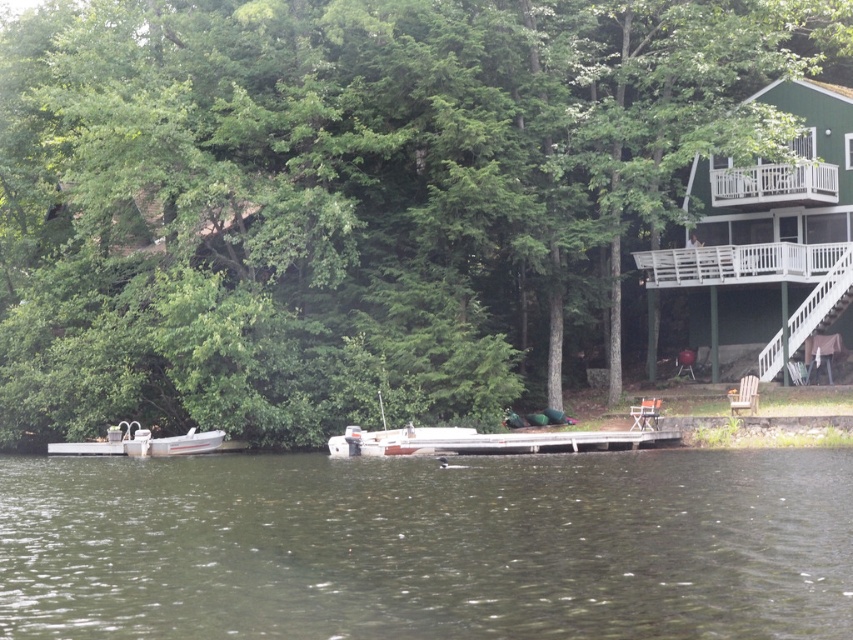
Question: Which point is farther to the camera?

Choices:
 (A) green leafy tree at center
 (B) white plastic boat at lower left
 (C) green wood cabin at upper right

Answer: (C)

Question: Which of the following is the closest to the observer?

Choices:
 (A) green leafy tree at center
 (B) white plastic boat at lower left
 (C) green wood cabin at upper right

Answer: (A)

Question: Does green leafy tree at center have a smaller size compared to white plastic boat at lower left?

Choices:
 (A) yes
 (B) no

Answer: (B)

Question: Does green wood cabin at upper right appear under white plastic boat at lower left?

Choices:
 (A) yes
 (B) no

Answer: (B)

Question: Which point is farther to the camera?

Choices:
 (A) (752, 326)
 (B) (585, 64)

Answer: (A)

Question: Can you confirm if green leafy tree at center is positioned below green wood cabin at upper right?

Choices:
 (A) yes
 (B) no

Answer: (B)